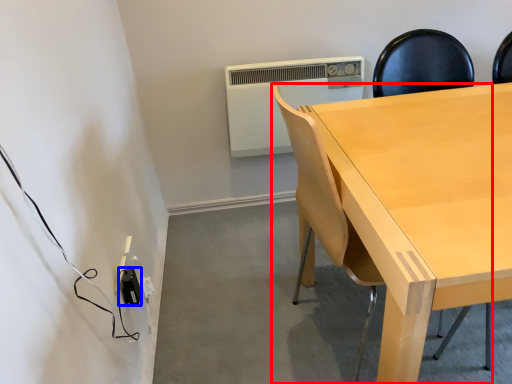
Question: Which of the following is the farthest to the observer, chair (highlighted by a red box) or electric outlet (highlighted by a blue box)?

Choices:
 (A) chair
 (B) electric outlet

Answer: (B)